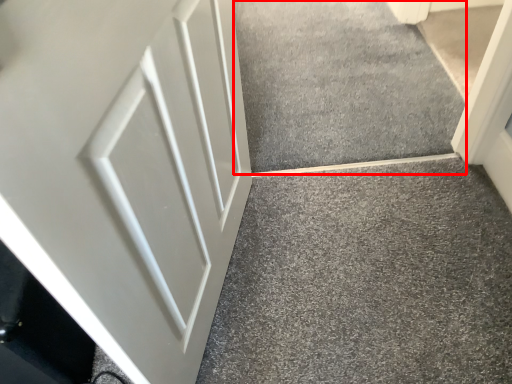
Question: Observing the image, what is the correct spatial positioning of concrete (annotated by the red box) in reference to door?

Choices:
 (A) right
 (B) left

Answer: (A)